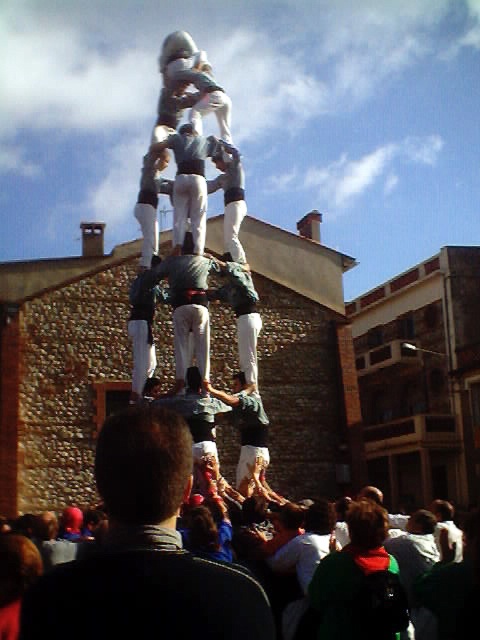
Question: Can you confirm if dark brown hair at center is positioned above white cotton shirt at center?

Choices:
 (A) yes
 (B) no

Answer: (A)

Question: Which point appears closest to the camera in this image?

Choices:
 (A) (144, 490)
 (B) (182, 248)

Answer: (A)

Question: Is dark brown hair at center smaller than dark gray fabric shirt at center?

Choices:
 (A) no
 (B) yes

Answer: (A)

Question: Estimate the real-world distances between objects in this image. Which object is closer to the dark brown hair at center?

Choices:
 (A) white cotton shirt at center
 (B) dark gray fabric shirt at center

Answer: (B)

Question: Is dark gray fabric shirt at center to the right of white cotton shirt at center from the viewer's perspective?

Choices:
 (A) no
 (B) yes

Answer: (A)

Question: Which is farther from the dark brown hair at center?

Choices:
 (A) white cotton shirt at center
 (B) dark gray fabric shirt at center

Answer: (A)